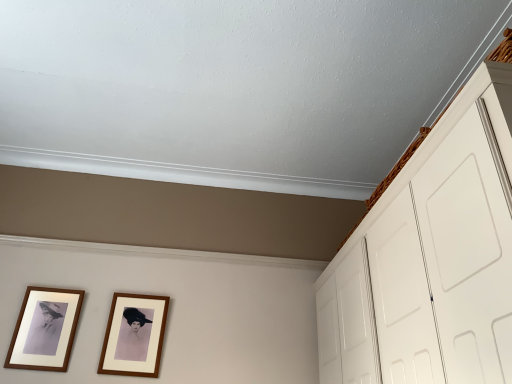
Question: Is white matte cabinet at upper right not near wooden framed photo at lower left, the 2th picture frame positioned from the right?

Choices:
 (A) no
 (B) yes

Answer: (B)

Question: From a real-world perspective, is white matte cabinet at upper right positioned over wooden framed photo at lower left, marked as the first picture frame in a left-to-right arrangement, based on gravity?

Choices:
 (A) yes
 (B) no

Answer: (B)

Question: Can you see white matte cabinet at upper right touching wooden framed photo at lower left, marked as the first picture frame in a left-to-right arrangement?

Choices:
 (A) yes
 (B) no

Answer: (B)

Question: Is white matte cabinet at upper right not within wooden framed photo at lower left, the 2th picture frame positioned from the right?

Choices:
 (A) no
 (B) yes

Answer: (B)

Question: Considering the relative positions of white matte cabinet at upper right and wooden framed photo at lower left, the 2th picture frame positioned from the right, in the image provided, is white matte cabinet at upper right to the right of wooden framed photo at lower left, the 2th picture frame positioned from the right, from the viewer's perspective?

Choices:
 (A) yes
 (B) no

Answer: (A)

Question: Considering the relative positions of white matte cabinet at upper right and wooden framed photo at lower left, marked as the first picture frame in a left-to-right arrangement, in the image provided, is white matte cabinet at upper right behind wooden framed photo at lower left, marked as the first picture frame in a left-to-right arrangement,?

Choices:
 (A) no
 (B) yes

Answer: (A)

Question: Considering the relative sizes of brown wooden picture frame at center, the first picture frame when ordered from right to left, and wooden framed photo at lower left, the 2th picture frame positioned from the right, in the image provided, is brown wooden picture frame at center, the first picture frame when ordered from right to left, taller than wooden framed photo at lower left, the 2th picture frame positioned from the right,?

Choices:
 (A) no
 (B) yes

Answer: (A)

Question: Does brown wooden picture frame at center, positioned as the 2th picture frame in left-to-right order, have a greater width compared to wooden framed photo at lower left, marked as the first picture frame in a left-to-right arrangement?

Choices:
 (A) no
 (B) yes

Answer: (B)

Question: Considering the relative sizes of brown wooden picture frame at center, positioned as the 2th picture frame in left-to-right order, and wooden framed photo at lower left, the 2th picture frame positioned from the right, in the image provided, is brown wooden picture frame at center, positioned as the 2th picture frame in left-to-right order, shorter than wooden framed photo at lower left, the 2th picture frame positioned from the right,?

Choices:
 (A) yes
 (B) no

Answer: (A)

Question: Could you tell me if brown wooden picture frame at center, the first picture frame when ordered from right to left, is turned towards wooden framed photo at lower left, marked as the first picture frame in a left-to-right arrangement?

Choices:
 (A) no
 (B) yes

Answer: (A)

Question: Is brown wooden picture frame at center, positioned as the 2th picture frame in left-to-right order, thinner than wooden framed photo at lower left, the 2th picture frame positioned from the right?

Choices:
 (A) yes
 (B) no

Answer: (B)

Question: Is brown wooden picture frame at center, positioned as the 2th picture frame in left-to-right order, to the right of wooden framed photo at lower left, the 2th picture frame positioned from the right, from the viewer's perspective?

Choices:
 (A) no
 (B) yes

Answer: (B)

Question: Is wooden framed photo at lower left, marked as the first picture frame in a left-to-right arrangement, beside brown wooden picture frame at center, positioned as the 2th picture frame in left-to-right order?

Choices:
 (A) no
 (B) yes

Answer: (A)